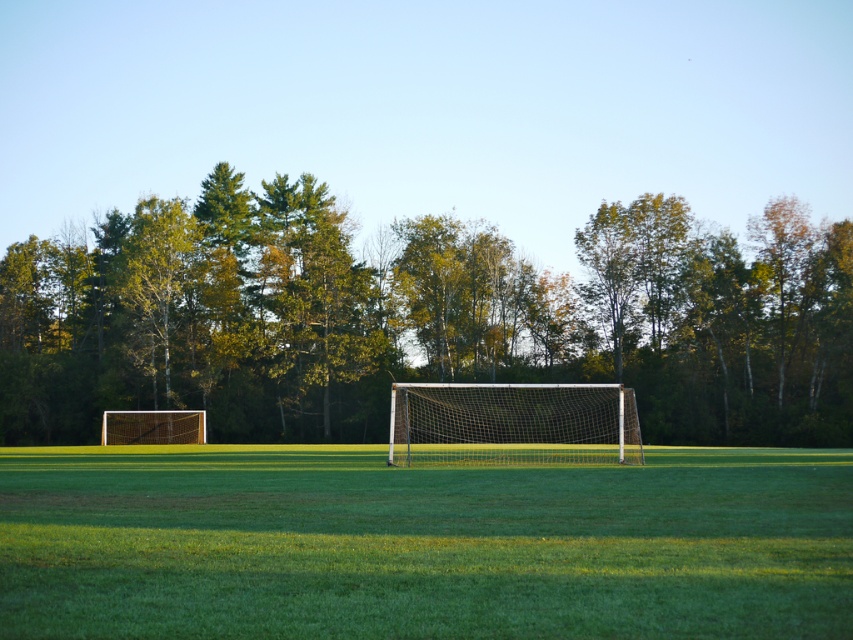
Question: Among these points, which one is nearest to the camera?

Choices:
 (A) (425, 432)
 (B) (503, 321)

Answer: (A)

Question: Is green grass at center further to the viewer compared to metallic silver goal at left?

Choices:
 (A) no
 (B) yes

Answer: (A)

Question: Which point is closer to the camera?

Choices:
 (A) white mesh net at center
 (B) metallic silver goal at left
 (C) green leafy tree at center
 (D) green grass at center

Answer: (D)

Question: Is green grass at center to the right of metallic silver goal at left from the viewer's perspective?

Choices:
 (A) no
 (B) yes

Answer: (B)

Question: Does green grass at center appear on the left side of metallic silver goal at left?

Choices:
 (A) no
 (B) yes

Answer: (A)

Question: Which object is the closest to the metallic silver goal at left?

Choices:
 (A) white mesh net at center
 (B) green leafy tree at center

Answer: (B)